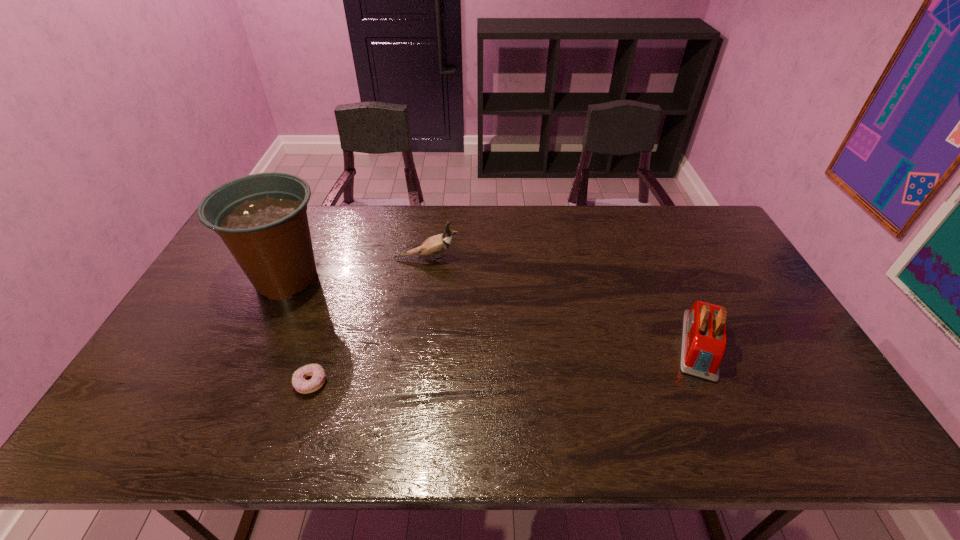
This screenshot has width=960, height=540. In order to click on flowerpot in this screenshot , I will do `click(262, 218)`.

The image size is (960, 540). In order to click on bird in this screenshot , I will do `click(435, 245)`.

At what (x,y) coordinates should I click in order to perform the action: click on the rightmost object. Please return your answer as a coordinate pair (x, y). The height and width of the screenshot is (540, 960). Looking at the image, I should click on (703, 347).

The width and height of the screenshot is (960, 540). I want to click on doughnut, so click(299, 382).

I want to click on vacant space situated on the front of the tallest object, so click(241, 377).

I want to click on free region located 0.350m at the face of the second object from right to left, so pos(566,259).

Identify the location of vacant space located on the back of the toaster. The height and width of the screenshot is (540, 960). (654, 244).

You are a GUI agent. You are given a task and a screenshot of the screen. Output one action in this format:
    pyautogui.click(x=<x>, y=<y>)
    Task: Click on the vacant area situated on the right of the doughnut
    
    Given the screenshot: What is the action you would take?
    pyautogui.click(x=395, y=383)

Find the location of a particular element. The image size is (960, 540). object situated at the left edge is located at coordinates (262, 218).

The height and width of the screenshot is (540, 960). Identify the location of free region at the far edge of the desktop. (613, 219).